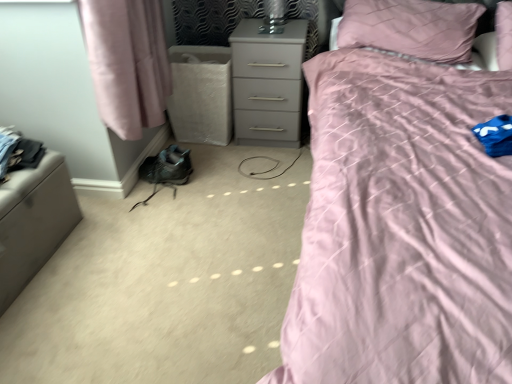
Identify the location of free space in front of matte gray nightstand at center. (260, 165).